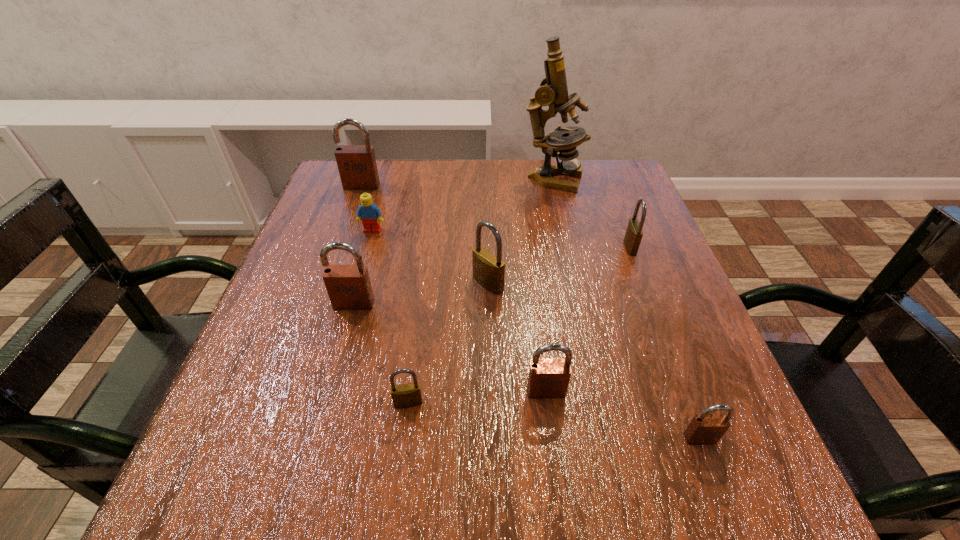
This screenshot has width=960, height=540. I want to click on unoccupied position between the third padlock from right to left and the second farthest brown padlock, so click(x=450, y=348).

Image resolution: width=960 pixels, height=540 pixels. I want to click on vacant point located between the microscope and the fifth farthest object, so click(x=520, y=231).

This screenshot has height=540, width=960. Find the location of `vacant region between the second tallest object and the nearest object`. vacant region between the second tallest object and the nearest object is located at coordinates (531, 312).

This screenshot has width=960, height=540. I want to click on free spot between the nearest brass padlock and the rightmost brass padlock, so click(519, 325).

Where is `unoccupied position between the tallest object and the biggest brass padlock`? The width and height of the screenshot is (960, 540). unoccupied position between the tallest object and the biggest brass padlock is located at coordinates (520, 231).

Where is `vacant region between the fifth farthest object and the second farthest brown padlock`? The height and width of the screenshot is (540, 960). vacant region between the fifth farthest object and the second farthest brown padlock is located at coordinates (420, 294).

At what (x,y) coordinates should I click in order to perform the action: click on unoccupied area between the smallest brown padlock and the fourth farthest object. Please return your answer as a coordinate pair (x, y). Image resolution: width=960 pixels, height=540 pixels. Looking at the image, I should click on (665, 342).

You are a GUI agent. You are given a task and a screenshot of the screen. Output one action in this format:
    pyautogui.click(x=<x>, y=<y>)
    Task: Click on the object that is the fourth closest one to the farthest brown padlock
    This screenshot has height=540, width=960.
    Given the screenshot: What is the action you would take?
    pyautogui.click(x=488, y=270)

Identify the location of object that stands as the seventh closest to the biggest brass padlock. Image resolution: width=960 pixels, height=540 pixels. (704, 428).

Identify which padlock is the sixth nearest to the third brown padlock from left to right. Please provide its 2D coordinates. Your answer should be formatted as a tuple, i.e. [(x, y)], where the tuple contains the x and y coordinates of a point satisfying the conditions above.

[(357, 167)]